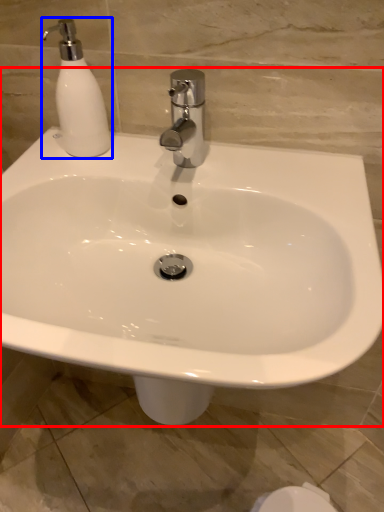
Question: Which object is closer to the camera taking this photo, sink (highlighted by a red box) or soap dispenser (highlighted by a blue box)?

Choices:
 (A) sink
 (B) soap dispenser

Answer: (A)